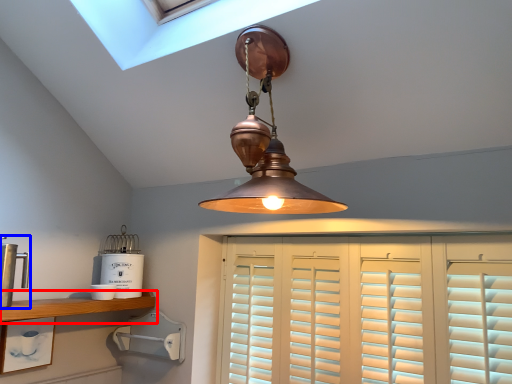
Question: Which point is further to the camera, shelf (highlighted by a red box) or appliance (highlighted by a blue box)?

Choices:
 (A) shelf
 (B) appliance

Answer: (A)